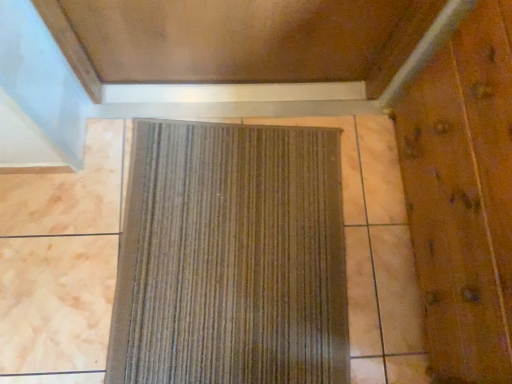
Question: From the image's perspective, relative to wooden elevator door at right, is brown textured mat at center above or below?

Choices:
 (A) below
 (B) above

Answer: (A)

Question: Which is correct: brown textured mat at center is inside wooden elevator door at right, or outside of it?

Choices:
 (A) outside
 (B) inside

Answer: (A)

Question: Is point (166, 367) closer or farther from the camera than point (500, 94)?

Choices:
 (A) closer
 (B) farther

Answer: (B)

Question: From the image's perspective, is wooden elevator door at right positioned above or below brown textured mat at center?

Choices:
 (A) above
 (B) below

Answer: (A)

Question: Choose the correct answer: Is wooden elevator door at right inside brown textured mat at center or outside it?

Choices:
 (A) outside
 (B) inside

Answer: (A)

Question: Is wooden elevator door at right wider or thinner than brown textured mat at center?

Choices:
 (A) thin
 (B) wide

Answer: (A)

Question: From a real-world perspective, is wooden elevator door at right above or below brown textured mat at center?

Choices:
 (A) below
 (B) above

Answer: (B)